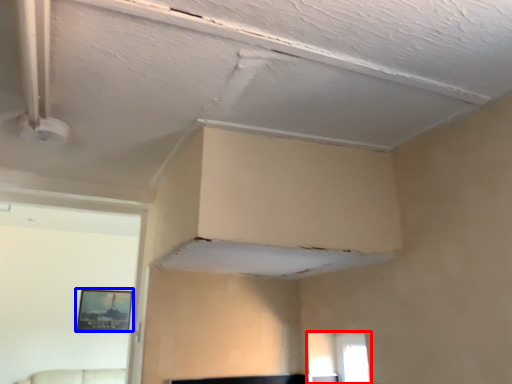
Question: Which object appears farthest to the camera in this image, window (highlighted by a red box) or picture frame (highlighted by a blue box)?

Choices:
 (A) window
 (B) picture frame

Answer: (B)